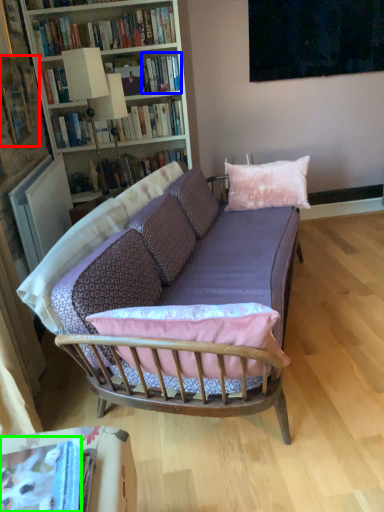
Question: Which object is positioned closest to book (highlighted by a red box)? Select from book (highlighted by a blue box) and book (highlighted by a green box).

Choices:
 (A) book
 (B) book

Answer: (A)